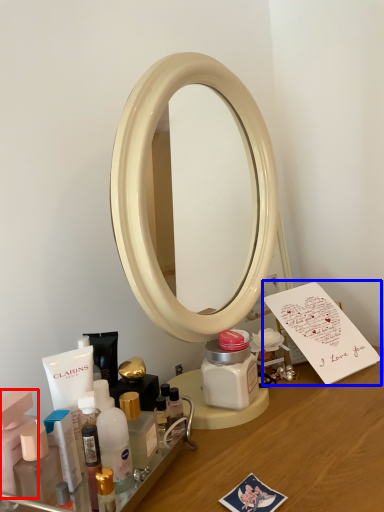
Question: Which point is further to the camera, toiletry (highlighted by a red box) or postcard (highlighted by a blue box)?

Choices:
 (A) toiletry
 (B) postcard

Answer: (B)